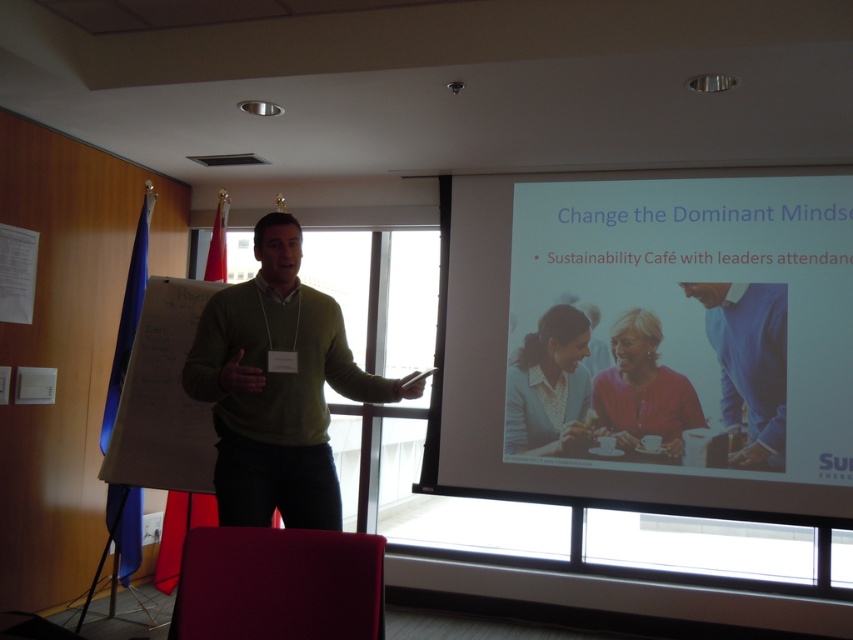
Question: Does white glossy projector screen at upper center appear on the right side of white paper at center?

Choices:
 (A) no
 (B) yes

Answer: (B)

Question: Among these objects, which one is farthest from the camera?

Choices:
 (A) white paper at center
 (B) green matte sweater at center
 (C) white glossy projector screen at upper center

Answer: (C)

Question: Which of these objects is positioned closest to the green matte sweater at center?

Choices:
 (A) blue cotton shirt at center
 (B) white glossy projector screen at upper center
 (C) white paper at center

Answer: (C)

Question: Can you confirm if white glossy projector screen at upper center is bigger than white paper at center?

Choices:
 (A) yes
 (B) no

Answer: (A)

Question: Which point is closer to the camera taking this photo?

Choices:
 (A) pos(752,346)
 (B) pos(753,362)

Answer: (B)

Question: From the image, what is the correct spatial relationship of green matte sweater at center in relation to blue cotton shirt at center?

Choices:
 (A) above
 (B) below

Answer: (A)